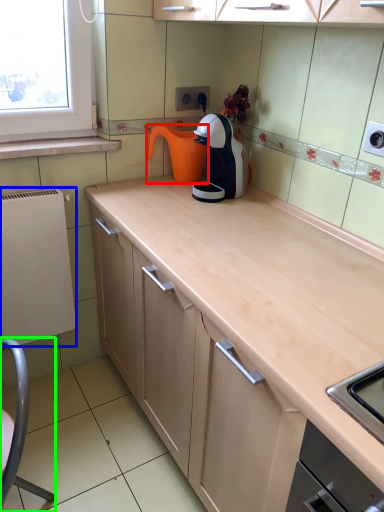
Question: Estimate the real-world distances between objects in this image. Which object is farther from coffeepot (highlighted by a red box), appliance (highlighted by a blue box) or swivel chair (highlighted by a green box)?

Choices:
 (A) appliance
 (B) swivel chair

Answer: (B)